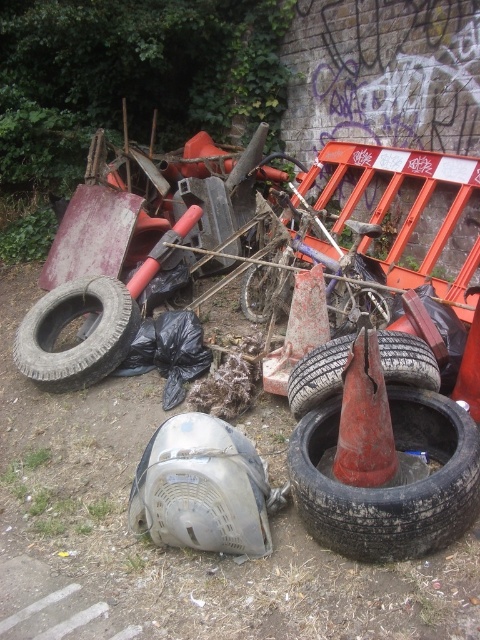
You are a delivery person trying to place a new traffic cone that is the same size as the smooth red traffic cone at center into a storage box. The box can only hold items narrower than the flat black tire at lower right. Will the new traffic cone fit in the box?

The smooth red traffic cone at center is narrower than the flat black tire at lower right, so the new traffic cone will fit in the box since its width is less than the tire.

You are a delivery robot that is 12 inches wide. You need to move from the smooth red traffic cone at center to the flat black tire at lower right. Can you fit through the space between them?

The distance between the smooth red traffic cone at center and the flat black tire at lower right is 10.83 inches. Since the robot is 12 inches wide, it cannot fit through the space between them.